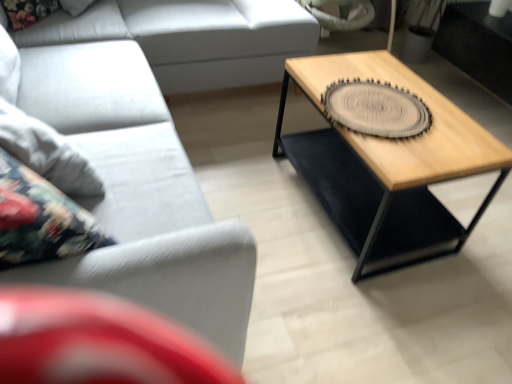
Locate an element on the screen. The image size is (512, 384). gray textured coaster at center right is located at coordinates click(x=375, y=109).

Describe the element at coordinates (387, 164) in the screenshot. I see `wooden/black metal coffee table at right` at that location.

The height and width of the screenshot is (384, 512). What do you see at coordinates (143, 163) in the screenshot?
I see `matte gray couch at lower left, which is the 2th studio couch from back to front` at bounding box center [143, 163].

Identify the location of gray textured coaster at center right. (375, 109).

Measure the distance from light gray fabric couch at left, marked as the 2th studio couch in a front-to-back arrangement, to matte gray couch at lower left, which is the 2th studio couch from back to front.

light gray fabric couch at left, marked as the 2th studio couch in a front-to-back arrangement, is 6.33 inches away from matte gray couch at lower left, which is the 2th studio couch from back to front.

Between light gray fabric couch at left, the 1th studio couch positioned from the back, and matte gray couch at lower left, which is the 2th studio couch from back to front, which one has larger width?

light gray fabric couch at left, the 1th studio couch positioned from the back, is wider.

Which is behind, point (48, 22) or point (151, 252)?

The point (48, 22) is more distant.

Is matte gray couch at lower left, which ranks as the 1th studio couch in front-to-back order, at the back of light gray fabric couch at left, marked as the 2th studio couch in a front-to-back arrangement?

No, light gray fabric couch at left, marked as the 2th studio couch in a front-to-back arrangement, is not facing the opposite direction of matte gray couch at lower left, which ranks as the 1th studio couch in front-to-back order.

Between matte gray couch at lower left, which is the 2th studio couch from back to front, and wooden/black metal coffee table at right, which one is positioned behind?

wooden/black metal coffee table at right is behind.

From a real-world perspective, which object rests below the other?

In real-world perspective, wooden/black metal coffee table at right is lower.

Who is smaller, matte gray couch at lower left, which is the 2th studio couch from back to front, or wooden/black metal coffee table at right?

wooden/black metal coffee table at right is smaller.

Measure the distance from matte gray couch at lower left, which is the 2th studio couch from back to front, to wooden/black metal coffee table at right.

74.14 centimeters.

Which object is positioned more to the left, wooden/black metal coffee table at right or gray textured coaster at center right?

gray textured coaster at center right.

Is wooden/black metal coffee table at right turned away from gray textured coaster at center right?

No, wooden/black metal coffee table at right is not facing away from gray textured coaster at center right.

The image size is (512, 384). Identify the location of coaster to the left of wooden/black metal coffee table at right. (375, 109).

From a real-world perspective, between wooden/black metal coffee table at right and gray textured coaster at center right, who is vertically higher?

gray textured coaster at center right.

Relative to light gray fabric couch at left, the 1th studio couch positioned from the back, is matte gray couch at lower left, which is the 2th studio couch from back to front, in front or behind?

In the image, matte gray couch at lower left, which is the 2th studio couch from back to front, appears in front of light gray fabric couch at left, the 1th studio couch positioned from the back.

In terms of width, does matte gray couch at lower left, which is the 2th studio couch from back to front, look wider or thinner when compared to light gray fabric couch at left, the 1th studio couch positioned from the back?

Clearly, matte gray couch at lower left, which is the 2th studio couch from back to front, has less width compared to light gray fabric couch at left, the 1th studio couch positioned from the back.

Does matte gray couch at lower left, which ranks as the 1th studio couch in front-to-back order, have a lesser height compared to light gray fabric couch at left, the 1th studio couch positioned from the back?

Incorrect, the height of matte gray couch at lower left, which ranks as the 1th studio couch in front-to-back order, does not fall short of that of light gray fabric couch at left, the 1th studio couch positioned from the back.

Is matte gray couch at lower left, which is the 2th studio couch from back to front, facing away from light gray fabric couch at left, the 1th studio couch positioned from the back?

No, matte gray couch at lower left, which is the 2th studio couch from back to front, is not facing the opposite direction of light gray fabric couch at left, the 1th studio couch positioned from the back.

In the scene shown: Can you see matte gray couch at lower left, which ranks as the 1th studio couch in front-to-back order, touching gray textured coaster at center right?

No, matte gray couch at lower left, which ranks as the 1th studio couch in front-to-back order, is not making contact with gray textured coaster at center right.

Which of these two, matte gray couch at lower left, which ranks as the 1th studio couch in front-to-back order, or gray textured coaster at center right, is thinner?

Thinner between the two is gray textured coaster at center right.

Between matte gray couch at lower left, which is the 2th studio couch from back to front, and gray textured coaster at center right, which one has smaller size?

gray textured coaster at center right.

From a real-world perspective, who is located higher, matte gray couch at lower left, which ranks as the 1th studio couch in front-to-back order, or gray textured coaster at center right?

gray textured coaster at center right is physically above.

Is gray textured coaster at center right not inside matte gray couch at lower left, which ranks as the 1th studio couch in front-to-back order?

Yes, gray textured coaster at center right is outside of matte gray couch at lower left, which ranks as the 1th studio couch in front-to-back order.

Is gray textured coaster at center right aimed at matte gray couch at lower left, which ranks as the 1th studio couch in front-to-back order?

No, gray textured coaster at center right is not aimed at matte gray couch at lower left, which ranks as the 1th studio couch in front-to-back order.

Considering the points (342, 96) and (141, 129), which point is behind, point (342, 96) or point (141, 129)?

The point (141, 129) is farther from the camera.

Between gray textured coaster at center right and matte gray couch at lower left, which is the 2th studio couch from back to front, which one appears on the right side from the viewer's perspective?

gray textured coaster at center right.

Which object is positioned more to the right, light gray fabric couch at left, marked as the 2th studio couch in a front-to-back arrangement, or gray textured coaster at center right?

Positioned to the right is gray textured coaster at center right.

From a real-world perspective, which object stands above the other?

In real-world perspective, gray textured coaster at center right is above.

From the image's perspective, is light gray fabric couch at left, the 1th studio couch positioned from the back, over gray textured coaster at center right?

Yes.

Is light gray fabric couch at left, the 1th studio couch positioned from the back, beside gray textured coaster at center right?

light gray fabric couch at left, the 1th studio couch positioned from the back, and gray textured coaster at center right are not in contact.

Find the location of a particular element. Image resolution: width=512 pixels, height=384 pixels. studio couch on the right of the matte gray couch at lower left, which is the 2th studio couch from back to front is located at coordinates (192, 38).

There is a wooden/black metal coffee table at right. Identify the location of the 1st studio couch above it (from the image's perspective). (143, 163).

Based on their spatial positions, is matte gray couch at lower left, which is the 2th studio couch from back to front, or gray textured coaster at center right closer to light gray fabric couch at left, marked as the 2th studio couch in a front-to-back arrangement?

matte gray couch at lower left, which is the 2th studio couch from back to front.

Which object lies nearer to the anchor point matte gray couch at lower left, which ranks as the 1th studio couch in front-to-back order, wooden/black metal coffee table at right or gray textured coaster at center right?

Among the two, wooden/black metal coffee table at right is located nearer to matte gray couch at lower left, which ranks as the 1th studio couch in front-to-back order.

Estimate the real-world distances between objects in this image. Which object is further from gray textured coaster at center right, wooden/black metal coffee table at right or light gray fabric couch at left, marked as the 2th studio couch in a front-to-back arrangement?

Based on the image, light gray fabric couch at left, marked as the 2th studio couch in a front-to-back arrangement, appears to be further to gray textured coaster at center right.

Which object lies nearer to the anchor point light gray fabric couch at left, marked as the 2th studio couch in a front-to-back arrangement, matte gray couch at lower left, which ranks as the 1th studio couch in front-to-back order, or wooden/black metal coffee table at right?

matte gray couch at lower left, which ranks as the 1th studio couch in front-to-back order.

When comparing their distances from matte gray couch at lower left, which ranks as the 1th studio couch in front-to-back order, does gray textured coaster at center right or light gray fabric couch at left, marked as the 2th studio couch in a front-to-back arrangement, seem further?

gray textured coaster at center right is further to matte gray couch at lower left, which ranks as the 1th studio couch in front-to-back order.

Based on their spatial positions, is light gray fabric couch at left, marked as the 2th studio couch in a front-to-back arrangement, or matte gray couch at lower left, which ranks as the 1th studio couch in front-to-back order, closer to wooden/black metal coffee table at right?

matte gray couch at lower left, which ranks as the 1th studio couch in front-to-back order.

Based on their spatial positions, is matte gray couch at lower left, which ranks as the 1th studio couch in front-to-back order, or wooden/black metal coffee table at right further from gray textured coaster at center right?

matte gray couch at lower left, which ranks as the 1th studio couch in front-to-back order, lies further to gray textured coaster at center right than the other object.

In the scene shown: When comparing their distances from gray textured coaster at center right, does wooden/black metal coffee table at right or matte gray couch at lower left, which ranks as the 1th studio couch in front-to-back order, seem closer?

Among the two, wooden/black metal coffee table at right is located nearer to gray textured coaster at center right.

Where is `coaster between matte gray couch at lower left, which ranks as the 1th studio couch in front-to-back order, and light gray fabric couch at left, marked as the 2th studio couch in a front-to-back arrangement, from front to back`? This screenshot has width=512, height=384. coaster between matte gray couch at lower left, which ranks as the 1th studio couch in front-to-back order, and light gray fabric couch at left, marked as the 2th studio couch in a front-to-back arrangement, from front to back is located at coordinates (375, 109).

Locate an element on the screen. This screenshot has height=384, width=512. studio couch located between matte gray couch at lower left, which is the 2th studio couch from back to front, and wooden/black metal coffee table at right in the left-right direction is located at coordinates (192, 38).

At what (x,y) coordinates should I click in order to perform the action: click on coaster located between matte gray couch at lower left, which is the 2th studio couch from back to front, and wooden/black metal coffee table at right in the left-right direction. Please return your answer as a coordinate pair (x, y). This screenshot has height=384, width=512. Looking at the image, I should click on (375, 109).

You are a GUI agent. You are given a task and a screenshot of the screen. Output one action in this format:
    pyautogui.click(x=<x>, y=<y>)
    Task: Click on the coaster between light gray fabric couch at left, marked as the 2th studio couch in a front-to-back arrangement, and wooden/black metal coffee table at right, in the horizontal direction
    
    Given the screenshot: What is the action you would take?
    pyautogui.click(x=375, y=109)